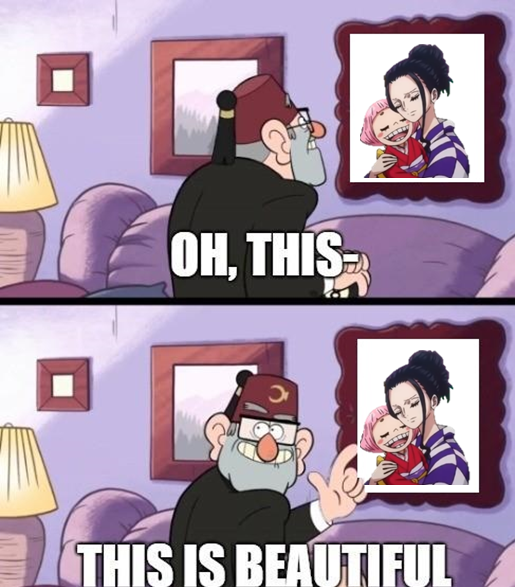
The image size is (515, 587). What are the coordinates of `blue background, wall` in the screenshot? It's located at (322, 384).